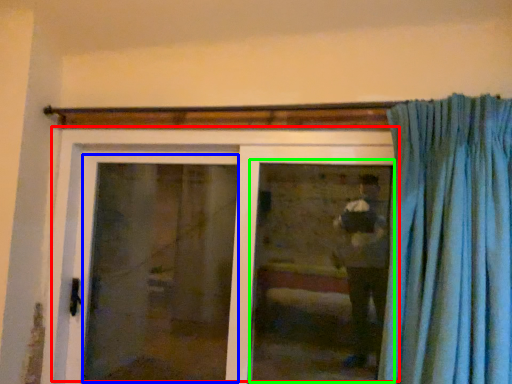
Question: Based on their relative distances, which object is nearer to door (highlighted by a red box)? Choose from screen door (highlighted by a blue box) and window (highlighted by a green box).

Choices:
 (A) screen door
 (B) window

Answer: (A)